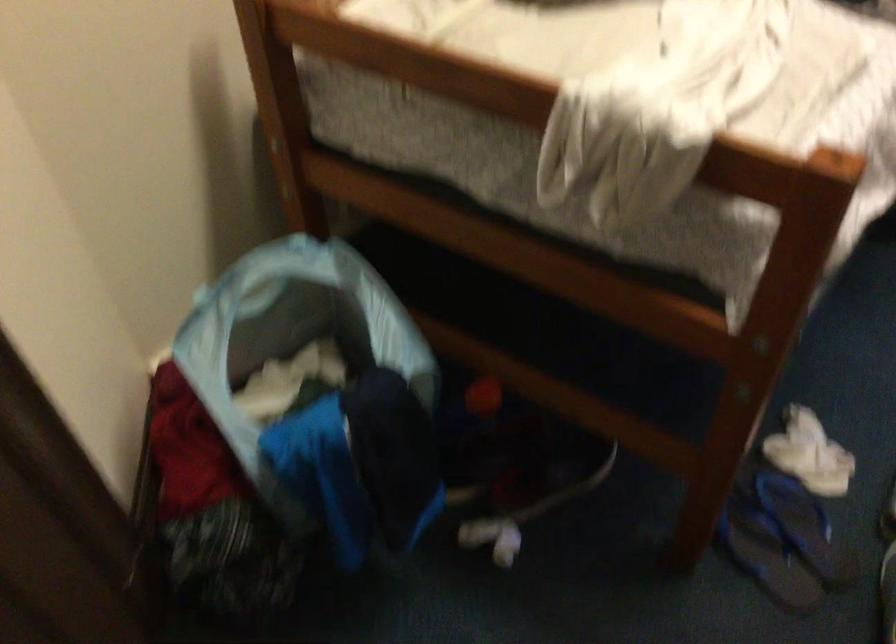
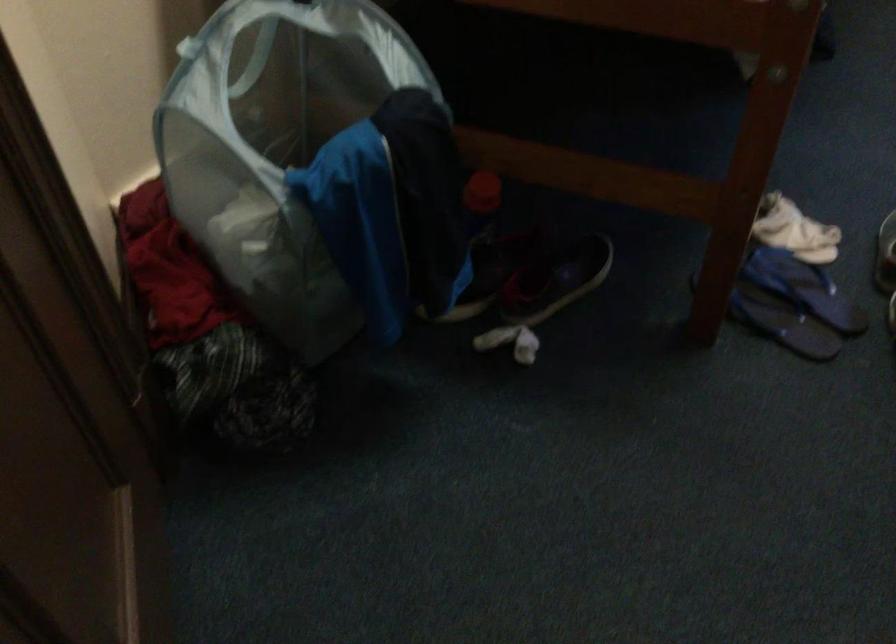
Locate, in the second image, the point that corresponds to (479,412) in the first image.

(480, 202)